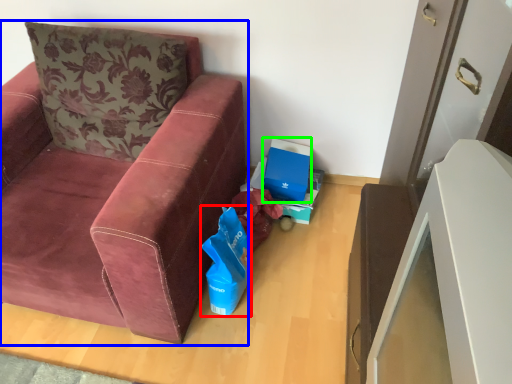
Question: Estimate the real-world distances between objects in this image. Which object is farther from gift bag (highlighted by a red box), studio couch (highlighted by a blue box) or cardboard box (highlighted by a green box)?

Choices:
 (A) studio couch
 (B) cardboard box

Answer: (B)